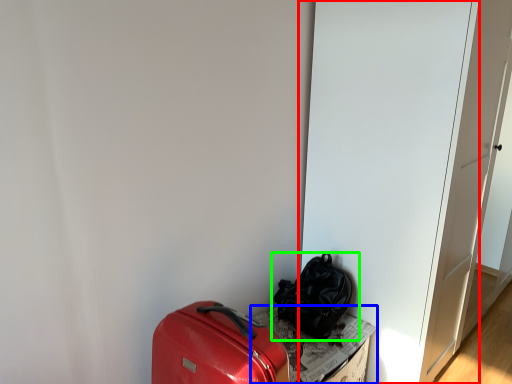
Question: Which is nearer to the door (highlighted by a red box)? cardboard box (highlighted by a blue box) or luggage and bags (highlighted by a green box).

Choices:
 (A) cardboard box
 (B) luggage and bags

Answer: (B)